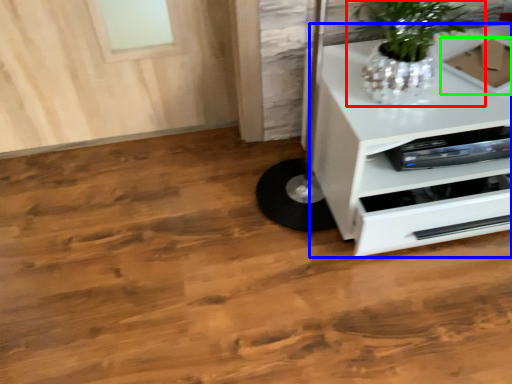
Question: Estimate the real-world distances between objects in this image. Which object is closer to houseplant (highlighted by a red box), chest of drawers (highlighted by a blue box) or cardboard box (highlighted by a green box)?

Choices:
 (A) chest of drawers
 (B) cardboard box

Answer: (A)